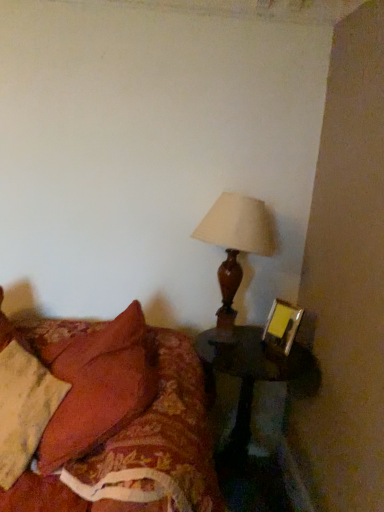
Question: Does floral fabric bed at lower left turn towards matte brown lamp at upper right?

Choices:
 (A) no
 (B) yes

Answer: (A)

Question: From the image's perspective, is floral fabric bed at lower left above matte brown lamp at upper right?

Choices:
 (A) no
 (B) yes

Answer: (A)

Question: Is floral fabric bed at lower left positioned behind matte brown lamp at upper right?

Choices:
 (A) no
 (B) yes

Answer: (A)

Question: Is floral fabric bed at lower left outside of matte brown lamp at upper right?

Choices:
 (A) no
 (B) yes

Answer: (B)

Question: From the image's perspective, is floral fabric bed at lower left under matte brown lamp at upper right?

Choices:
 (A) yes
 (B) no

Answer: (A)

Question: In terms of height, does matte brown lamp at upper right look taller or shorter compared to black wood side table at lower right?

Choices:
 (A) tall
 (B) short

Answer: (B)

Question: Based on their sizes in the image, would you say matte brown lamp at upper right is bigger or smaller than black wood side table at lower right?

Choices:
 (A) big
 (B) small

Answer: (B)

Question: From a real-world perspective, is matte brown lamp at upper right above or below black wood side table at lower right?

Choices:
 (A) above
 (B) below

Answer: (A)

Question: From the image's perspective, is matte brown lamp at upper right positioned above or below black wood side table at lower right?

Choices:
 (A) below
 (B) above

Answer: (B)

Question: From a real-world perspective, is velvet red pillow at lower left positioned above or below floral fabric bed at lower left?

Choices:
 (A) below
 (B) above

Answer: (A)

Question: Would you say velvet red pillow at lower left is to the left or to the right of floral fabric bed at lower left in the picture?

Choices:
 (A) left
 (B) right

Answer: (A)

Question: From their relative heights in the image, would you say velvet red pillow at lower left is taller or shorter than floral fabric bed at lower left?

Choices:
 (A) tall
 (B) short

Answer: (B)

Question: Considering the positions of point (34, 394) and point (11, 329), is point (34, 394) closer or farther from the camera than point (11, 329)?

Choices:
 (A) closer
 (B) farther

Answer: (A)

Question: From a real-world perspective, is velvet red pillow at lower left positioned above or below matte gold picture frame at right?

Choices:
 (A) below
 (B) above

Answer: (A)

Question: Does point (59, 395) appear closer or farther from the camera than point (273, 330)?

Choices:
 (A) closer
 (B) farther

Answer: (A)